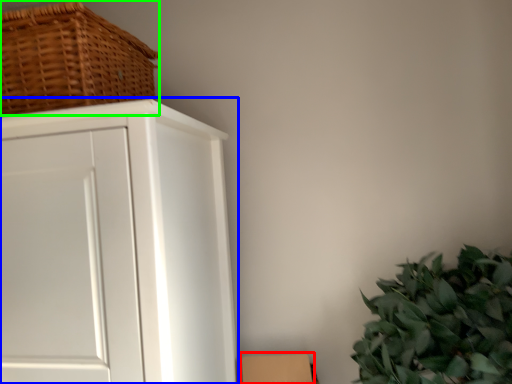
Question: Which is nearer to the cardboard box (highlighted by a red box)? cupboard (highlighted by a blue box) or basket (highlighted by a green box).

Choices:
 (A) cupboard
 (B) basket

Answer: (A)